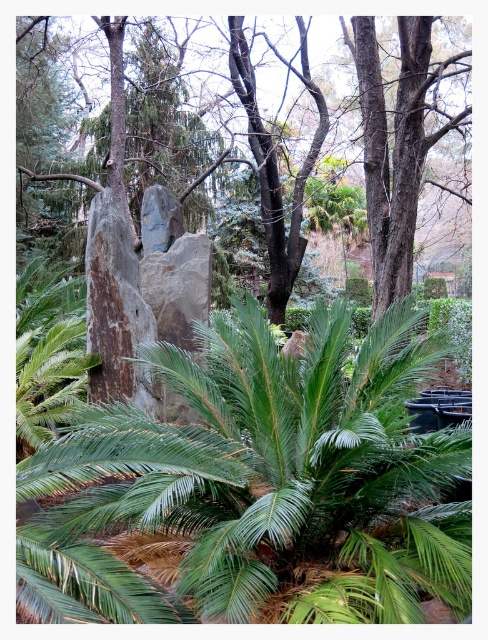
From the picture: You are standing at the camera position and want to reach the point marked at coordinates (427, 369). If your walking speed is 3 feet per second, how many seconds will it take you to reach that point?

The point marked at coordinates (427, 369) is 13.91 feet away from the camera. At a walking speed of 3 feet per second, it will take approximately 4.64 seconds to reach the point.

You are standing in a garden and see the green leafy palm at center and the rough bark tree at center. Which one is more to the left?

The green leafy palm at center is more to the left side of the rough bark tree at center.